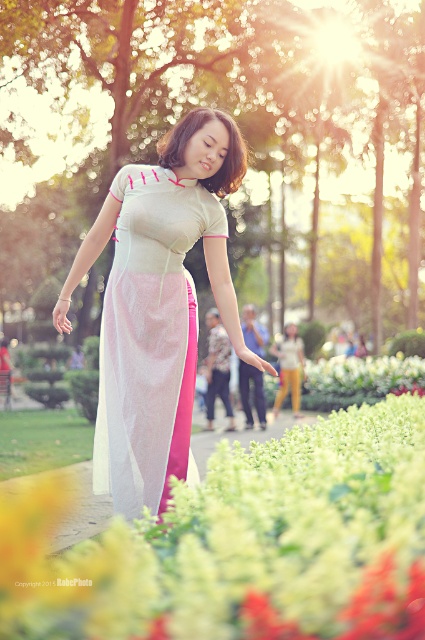
You are a photographer trying to capture the perfect shot of the woman in the scene. You notice the translucent silk skirt at center and the white sheer dress at center. Which object is positioned more to the right side of the image?

The translucent silk skirt at center is positioned more to the right of the image compared to the white sheer dress at center.

You are standing in the park and see two points marked in the image. Which point is closer to you, point (158, 618) or point (116, 189)?

Point (158, 618) is closer to the viewer than point (116, 189).

You are a photographer trying to capture the perfect shot of the translucent silk skirt at center. To ensure the skirt is in the center of your frame, where should you position your camera relative to the scene?

The translucent silk skirt at center is located at point 0.853 on the x axis and 0.572 on the y axis, so you should position your camera directly facing the center of the scene to ensure the skirt is centered in your frame.